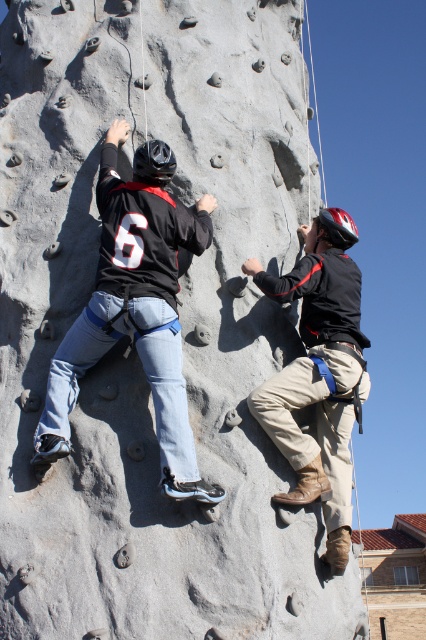
You are a rock climber preparing to place a safety anchor at point (135, 307). According to the image, what object is located at that coordinate?

The point (135, 307) marks the location of the matte black helmet at upper left.

You are a rock climber trying to decide which helmet to grab first. The matte black helmet at upper left and the matte black helmet at upper center are both within reach. Which one is closer to you?

The matte black helmet at upper left is closer to the viewer than the matte black helmet at upper center, so you should grab the matte black helmet at upper left first.